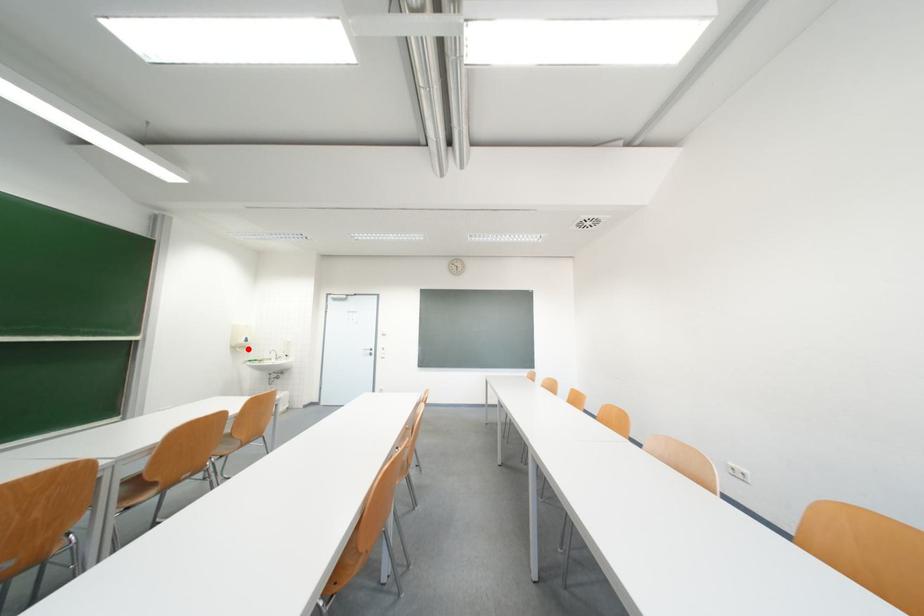
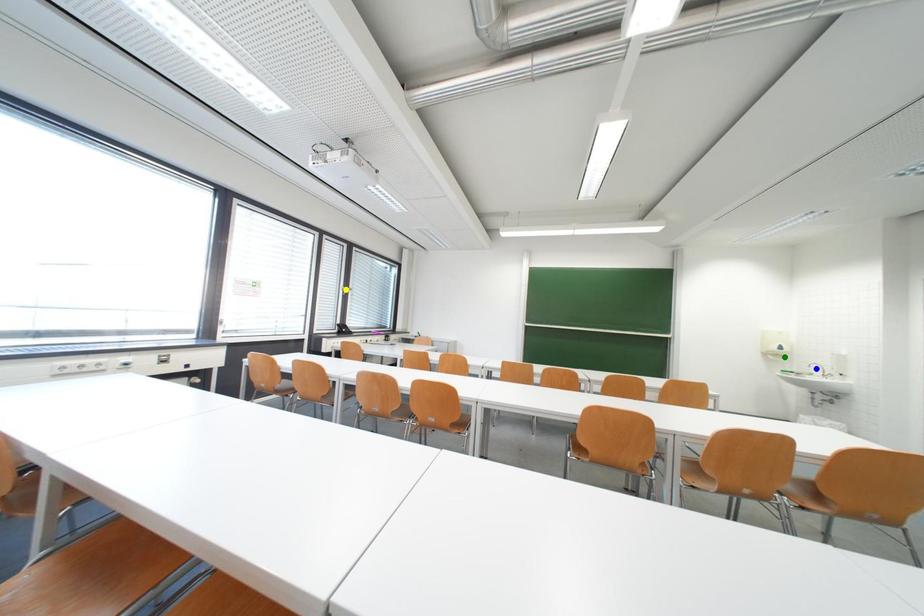
Question: I am providing you with two images of the same scene from different viewpoints. A red point is marked on the first image. You are given multiple points on the second image. Which spot in image 2 lines up with the point in image 1?

Choices:
 (A) blue point
 (B) green point
 (C) yellow point

Answer: (B)